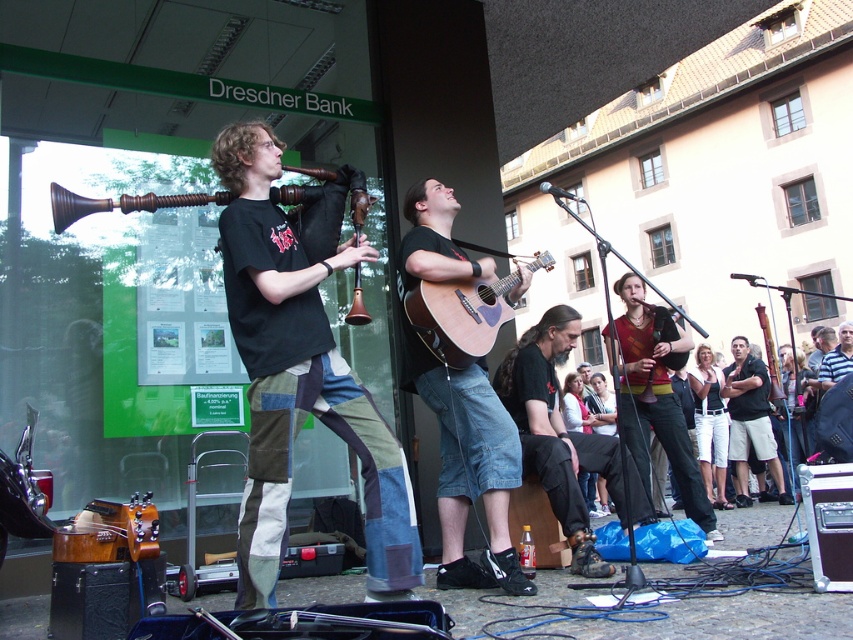
Is dark brown leather shoes at lower center closer to the viewer compared to matte brown vest at center?

Yes, it is in front of matte brown vest at center.

What do you see at coordinates (555, 432) in the screenshot? I see `dark brown leather shoes at lower center` at bounding box center [555, 432].

Is point (556, 486) closer to camera compared to point (663, 440)?

That is True.

Locate an element on the screen. The width and height of the screenshot is (853, 640). dark brown leather shoes at lower center is located at coordinates (555, 432).

Does matte brown vest at center appear on the right side of black cotton shirt at center?

Incorrect, matte brown vest at center is not on the right side of black cotton shirt at center.

The height and width of the screenshot is (640, 853). What are the coordinates of `matte brown vest at center` in the screenshot? It's located at (656, 397).

Is wooden acoustic guitar at center bigger than dark brown leather shoes at lower center?

Incorrect, wooden acoustic guitar at center is not larger than dark brown leather shoes at lower center.

In order to click on wooden acoustic guitar at center in this screenshot , I will do `click(468, 465)`.

Find the location of a particular element. wooden acoustic guitar at center is located at coordinates (468, 465).